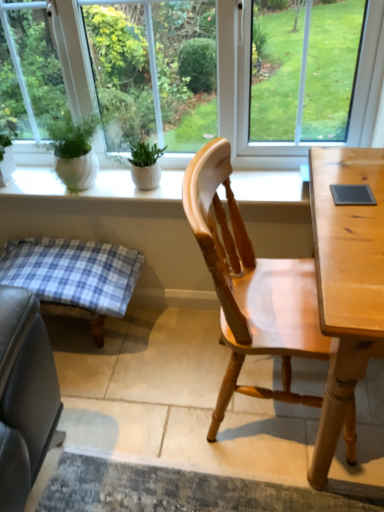
Question: Can you confirm if transparent glass window at center is smaller than white ceramic plant pots at upper center?

Choices:
 (A) no
 (B) yes

Answer: (A)

Question: Can you confirm if transparent glass window at center is taller than white ceramic plant pots at upper center?

Choices:
 (A) yes
 (B) no

Answer: (A)

Question: From a real-world perspective, is transparent glass window at center physically below white ceramic plant pots at upper center?

Choices:
 (A) yes
 (B) no

Answer: (B)

Question: Is transparent glass window at center surrounding white ceramic plant pots at upper center?

Choices:
 (A) no
 (B) yes

Answer: (A)

Question: From the image's perspective, does transparent glass window at center appear lower than white ceramic plant pots at upper center?

Choices:
 (A) no
 (B) yes

Answer: (A)

Question: Considering the relative positions of blue plaid cushion at lower left and white ceramic plant pots at upper center in the image provided, is blue plaid cushion at lower left to the left or to the right of white ceramic plant pots at upper center?

Choices:
 (A) left
 (B) right

Answer: (A)

Question: Relative to white ceramic plant pots at upper center, is blue plaid cushion at lower left in front or behind?

Choices:
 (A) behind
 (B) front

Answer: (B)

Question: From the image's perspective, is blue plaid cushion at lower left above or below white ceramic plant pots at upper center?

Choices:
 (A) above
 (B) below

Answer: (B)

Question: Based on their sizes in the image, would you say blue plaid cushion at lower left is bigger or smaller than white ceramic plant pots at upper center?

Choices:
 (A) big
 (B) small

Answer: (A)

Question: From the image's perspective, is blue plaid cushion at lower left above or below green matte plant at center?

Choices:
 (A) below
 (B) above

Answer: (A)

Question: Based on their positions, is blue plaid cushion at lower left located to the left or right of green matte plant at center?

Choices:
 (A) left
 (B) right

Answer: (A)

Question: Is blue plaid cushion at lower left inside the boundaries of green matte plant at center, or outside?

Choices:
 (A) inside
 (B) outside

Answer: (B)

Question: Considering their positions, is blue plaid cushion at lower left located in front of or behind green matte plant at center?

Choices:
 (A) behind
 (B) front

Answer: (B)

Question: Considering the positions of blue plaid cushion at lower left and light wood chair at center in the image, is blue plaid cushion at lower left taller or shorter than light wood chair at center?

Choices:
 (A) tall
 (B) short

Answer: (B)

Question: Does point (x=81, y=291) appear closer or farther from the camera than point (x=271, y=289)?

Choices:
 (A) farther
 (B) closer

Answer: (A)